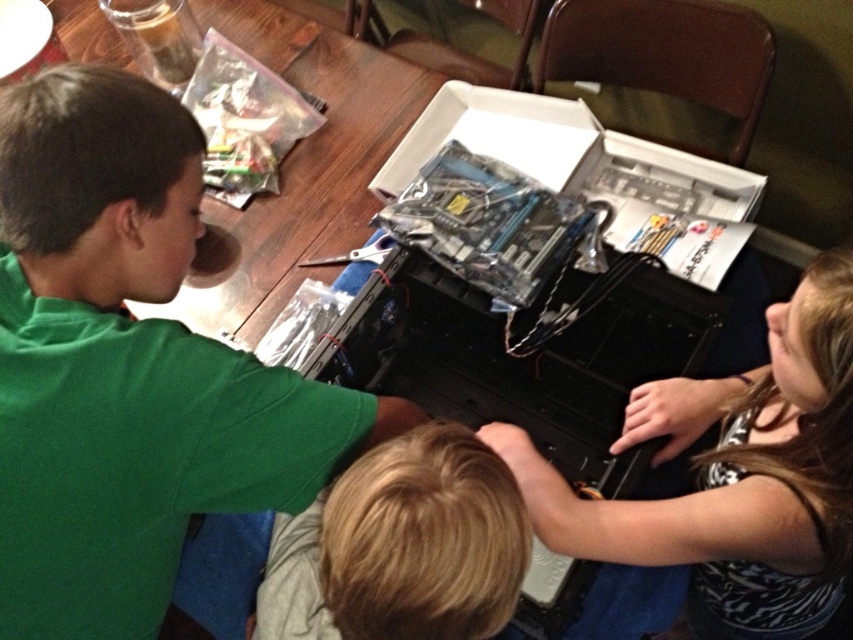
You are a photographer taking a picture of the children working on the computer. You notice the green matte shirt at upper left and the blonde hair at center. Which object is wider in the image?

The green matte shirt at upper left is wider than the blonde hair at center.

You are a photographer trying to capture a closeup of the green matte shirt at upper left and the blonde hair at center in the scene. The camera you are using has a maximum focus range of 8 inches. Can you fit both subjects within the camera focus range without moving the camera?

The green matte shirt at upper left and blonde hair at center are 8.65 inches apart from each other, which exceeds the camera focus range of 8 inches. Therefore, you cannot fit both subjects within the focus range without moving the camera.

You are a photographer taking a picture of the children working on the computer. You want to ensure both the green matte shirt at upper left and the blonde hair at center are visible in the frame. Based on their positions, which child is located more to the left?

The green matte shirt at upper left is positioned on the left side of blonde hair at center, so the child wearing the green matte shirt at upper left is more to the left.